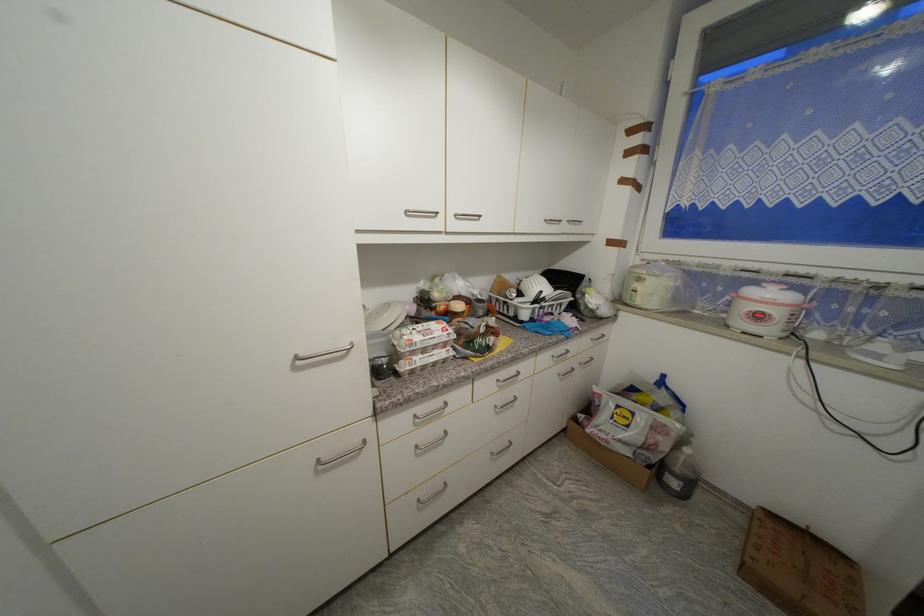
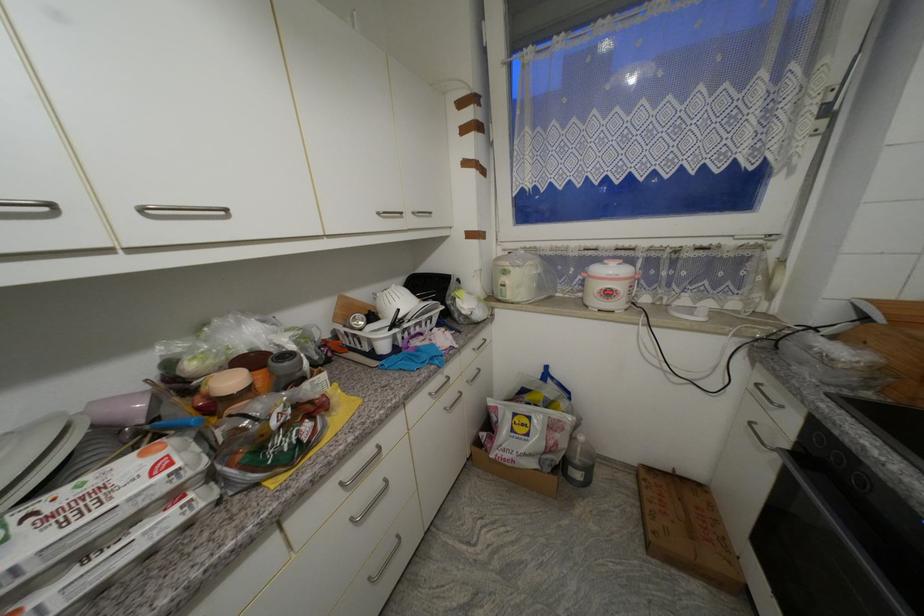
Question: How did the camera likely rotate?

Choices:
 (A) Left
 (B) Right
 (C) Up
 (D) Down

Answer: (B)